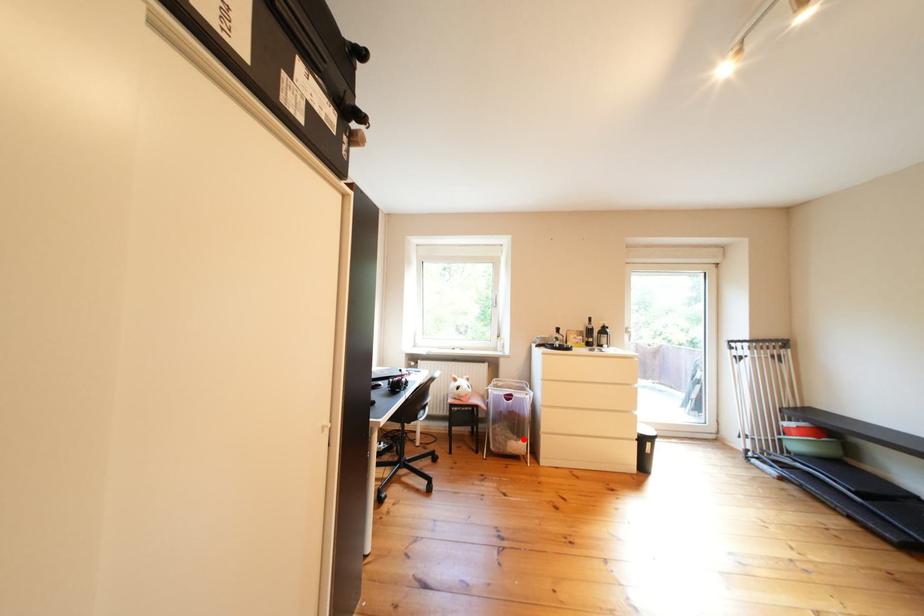
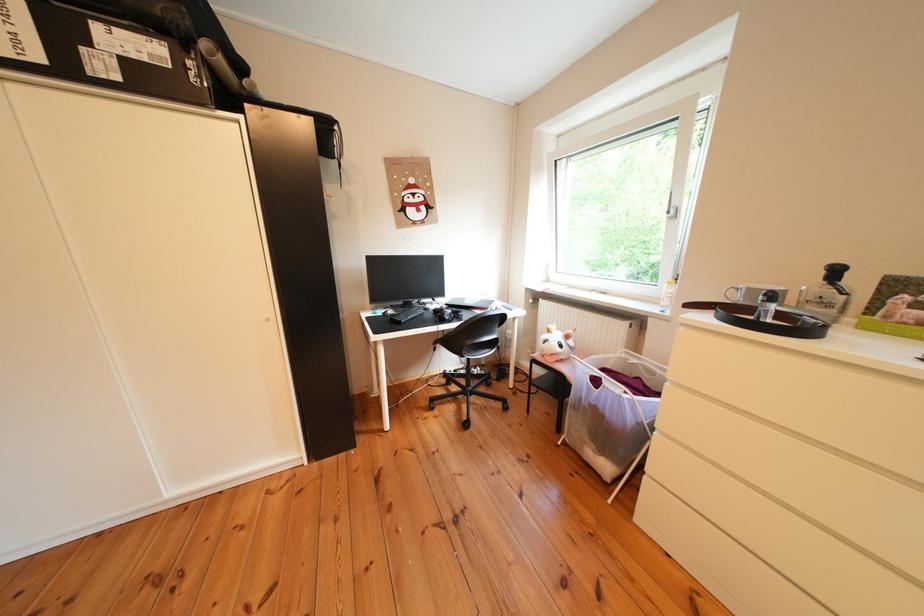
In the second image, find the point that corresponds to the highlighted location in the first image.

(601, 442)